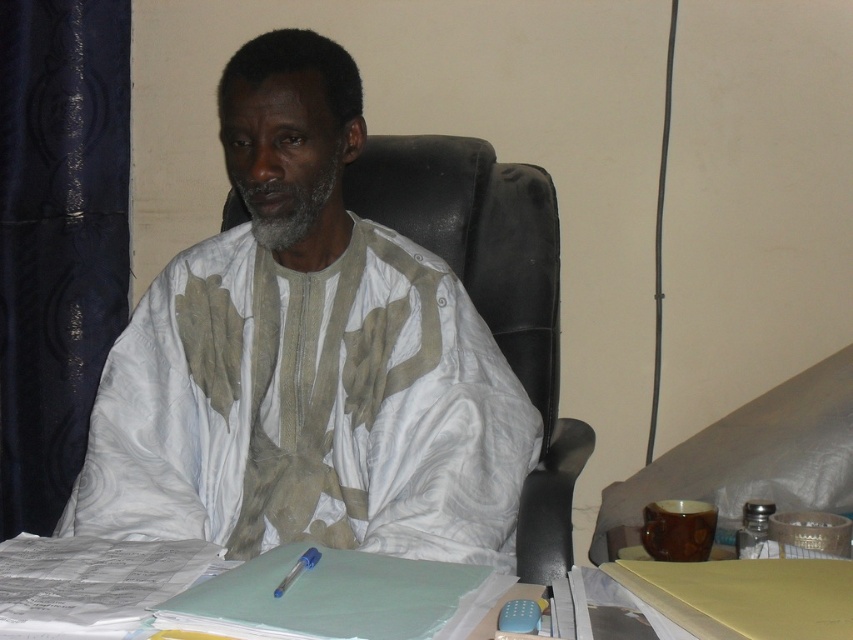
Question: Does white cotton shirt at center appear over white paper at lower center?

Choices:
 (A) yes
 (B) no

Answer: (A)

Question: Which point is closer to the camera?

Choices:
 (A) (155, 380)
 (B) (757, 604)

Answer: (B)

Question: Is white cotton shirt at center positioned before white paper at lower center?

Choices:
 (A) yes
 (B) no

Answer: (B)

Question: Can you confirm if white cotton shirt at center is thinner than white paper at lower center?

Choices:
 (A) yes
 (B) no

Answer: (B)